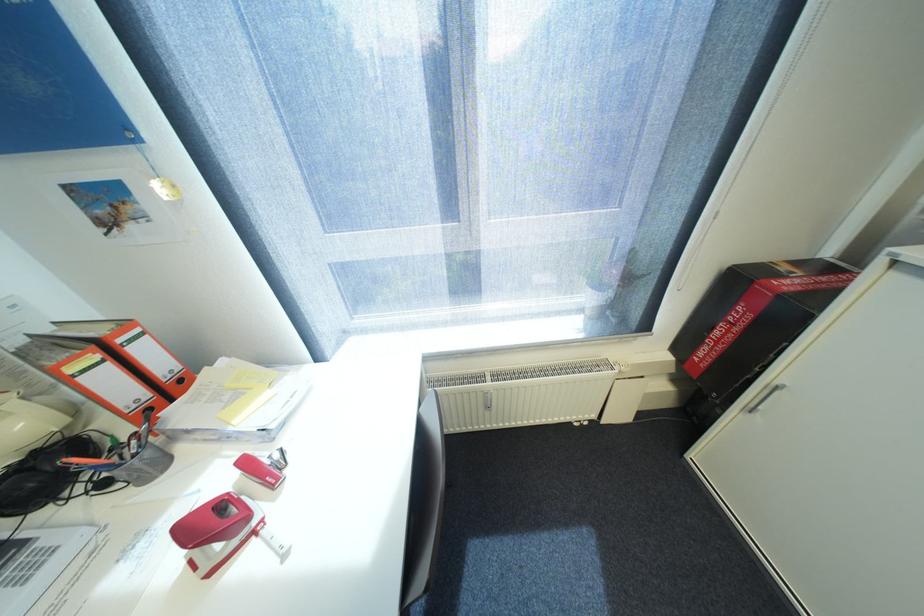
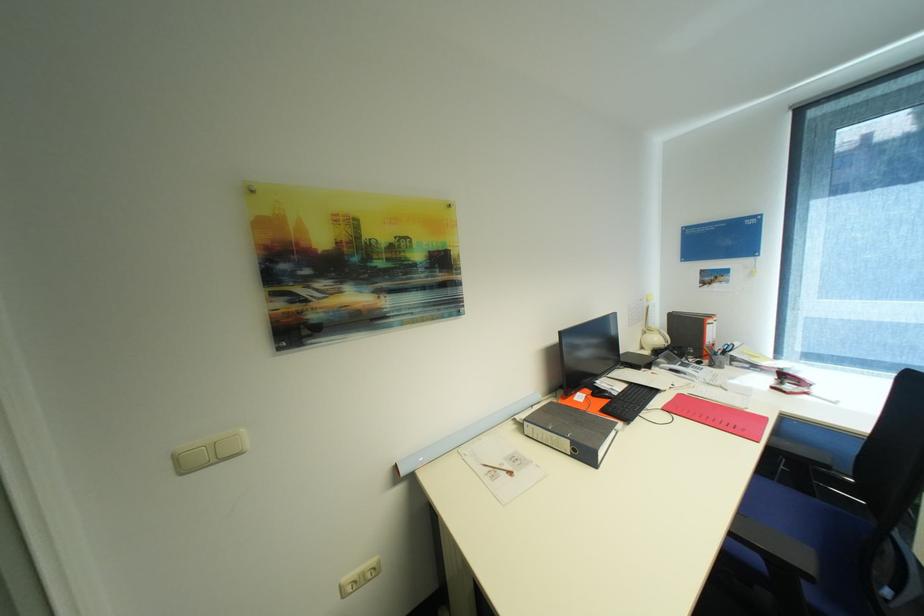
Locate, in the second image, the point that corresponds to the point at 30,424 in the first image.

(663, 339)